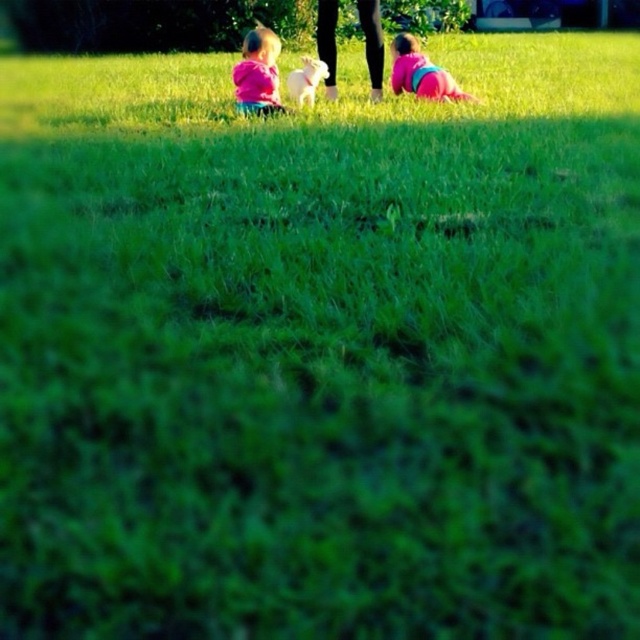
Consider the image. You are a photographer standing at the camera position. You want to take a clear photo of the pink matte shirt at center. Can you focus on it without adjusting your focus distance?

The pink matte shirt at center is 4.24 meters away from camera. Since the camera is focused on the background subjects, which are at that distance, the pink matte shirt at center will be in focus without needing adjustment.

Looking at this image, you are a photographer trying to capture a closeup of the pink matte shirt at center and the pink fabric baby at lower right. Since you want both subjects to be in focus, which subject should you adjust your camera focus to prioritize based on their sizes?

The pink matte shirt at center has a smaller width than the pink fabric baby at lower right, so you should prioritize focusing on the pink fabric baby at lower right to ensure both are in focus.

You are a photographer trying to capture both the pink matte shirt at center and the pink fabric baby at lower right in a single frame. Given their sizes, which object should you focus on first to ensure both are in focus?

The pink matte shirt at center is smaller than the pink fabric baby at lower right. To ensure both are in focus, you should focus on the pink fabric baby at lower right first since it is larger and might require more precise focusing to capture details.